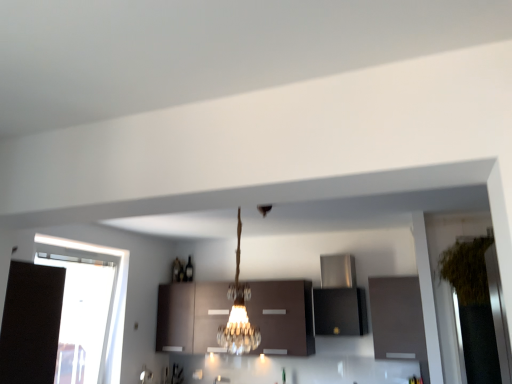
Question: Is matte brown cabinet at right, marked as the first cabinetry in a right-to-left arrangement, not close to transparent glass window at left?

Choices:
 (A) yes
 (B) no

Answer: (A)

Question: Can you confirm if matte brown cabinet at right, marked as the first cabinetry in a right-to-left arrangement, is positioned to the right of transparent glass window at left?

Choices:
 (A) no
 (B) yes

Answer: (B)

Question: Is transparent glass window at left a part of matte brown cabinet at right, the third cabinetry when ordered from left to right?

Choices:
 (A) no
 (B) yes

Answer: (A)

Question: Does matte brown cabinet at right, the third cabinetry when ordered from left to right, have a lesser width compared to transparent glass window at left?

Choices:
 (A) yes
 (B) no

Answer: (B)

Question: Is matte brown cabinet at right, marked as the first cabinetry in a right-to-left arrangement, to the left of transparent glass window at left from the viewer's perspective?

Choices:
 (A) yes
 (B) no

Answer: (B)

Question: Would you say matte brown cabinet at right, the third cabinetry when ordered from left to right, is outside transparent glass window at left?

Choices:
 (A) no
 (B) yes

Answer: (B)

Question: Is transparent glass window at left a part of matte brown cabinets at center, which is the third cabinetry in right-to-left order?

Choices:
 (A) no
 (B) yes

Answer: (A)

Question: From the image's perspective, is matte brown cabinets at center, the 1th cabinetry when ordered from left to right, over transparent glass window at left?

Choices:
 (A) yes
 (B) no

Answer: (B)

Question: Can we say matte brown cabinets at center, the 1th cabinetry when ordered from left to right, lies outside transparent glass window at left?

Choices:
 (A) yes
 (B) no

Answer: (A)

Question: Can you confirm if matte brown cabinets at center, the 1th cabinetry when ordered from left to right, is taller than transparent glass window at left?

Choices:
 (A) yes
 (B) no

Answer: (B)

Question: From the image's perspective, does matte brown cabinets at center, the 1th cabinetry when ordered from left to right, appear lower than transparent glass window at left?

Choices:
 (A) yes
 (B) no

Answer: (A)

Question: Is the depth of matte brown cabinets at center, which is the third cabinetry in right-to-left order, greater than that of transparent glass window at left?

Choices:
 (A) yes
 (B) no

Answer: (A)

Question: Is stainless steel range hood at upper center, placed as the second cabinetry when sorted from left to right, not close to green leafy plant at right?

Choices:
 (A) yes
 (B) no

Answer: (B)